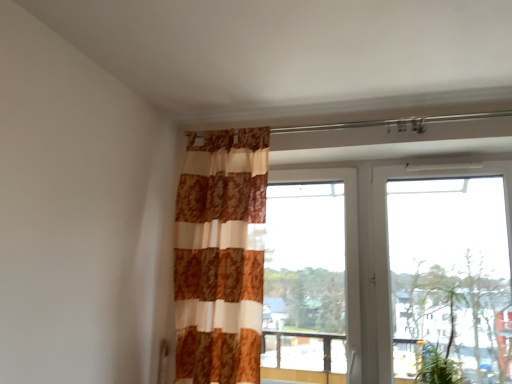
Question: Would you say white plastic window at upper right, the 2th window when ordered from left to right, is inside or outside transparent glass window at center, arranged as the 1th window when viewed from the left?

Choices:
 (A) outside
 (B) inside

Answer: (A)

Question: In the image, is white plastic window at upper right, the 1th window viewed from the right, positioned in front of or behind transparent glass window at center, arranged as the 1th window when viewed from the left?

Choices:
 (A) front
 (B) behind

Answer: (A)

Question: Which is nearer to the green leafy plant at lower right?

Choices:
 (A) transparent glass window at center, arranged as the 1th window when viewed from the left
 (B) patterned fabric curtain at center
 (C) white plastic window at upper right, the 1th window viewed from the right

Answer: (C)

Question: Considering the real-world distances, which object is closest to the white plastic window at upper right, the 2th window when ordered from left to right?

Choices:
 (A) green leafy plant at lower right
 (B) patterned fabric curtain at center
 (C) transparent glass window at center, acting as the 2th window starting from the right

Answer: (C)